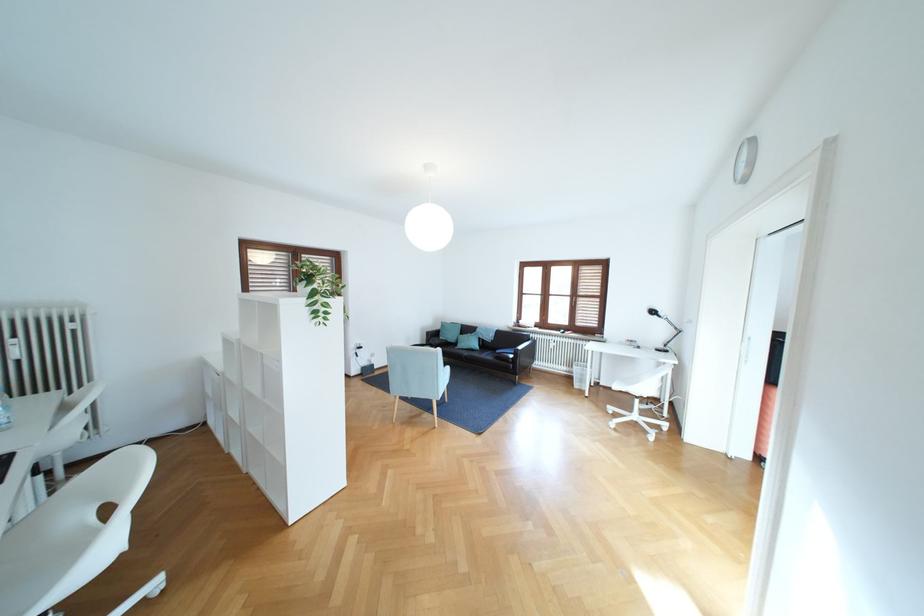
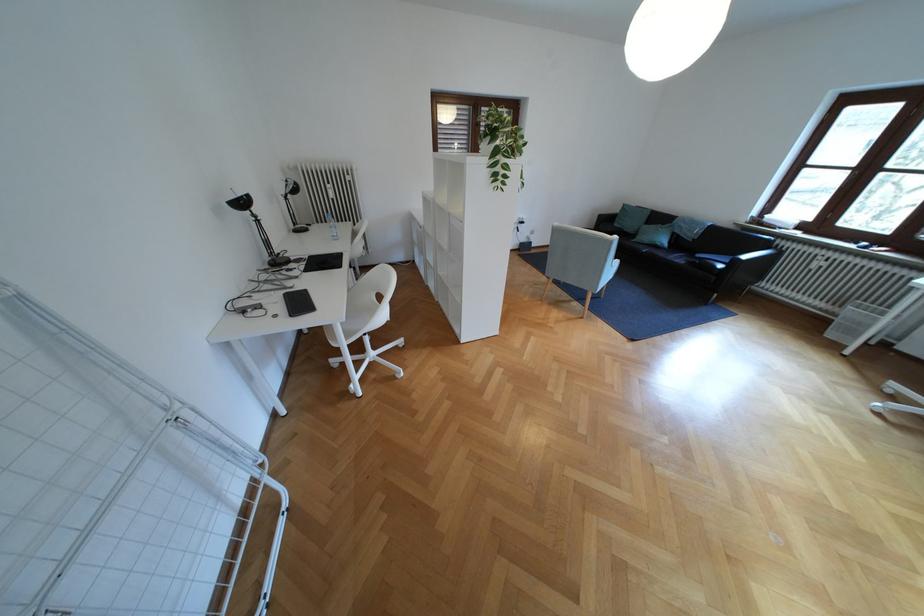
Find the pixel in the second image that matches point 469,346 in the first image.

(649, 238)